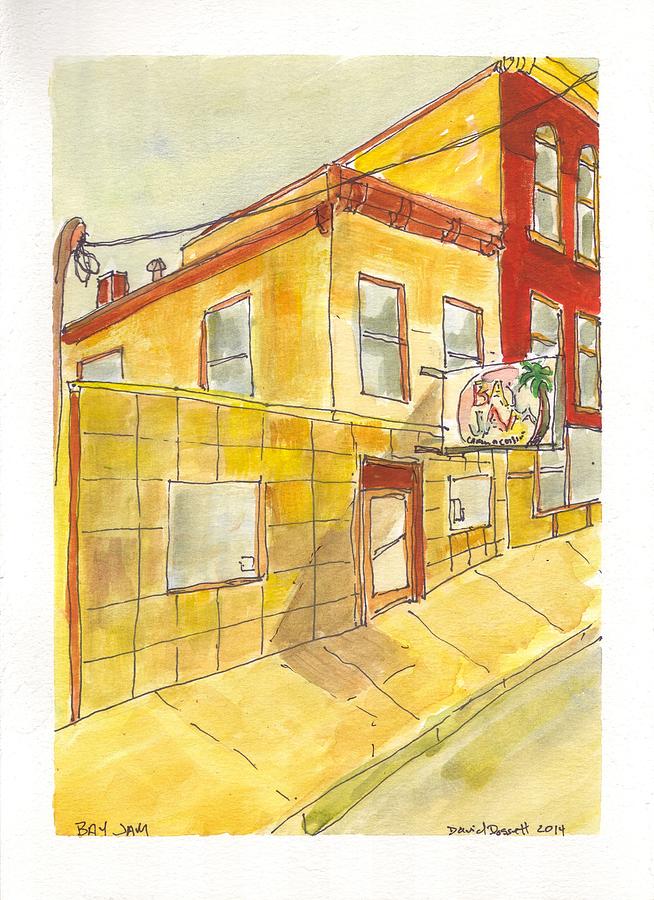
Where is `chimney`? chimney is located at coordinates (109, 285).